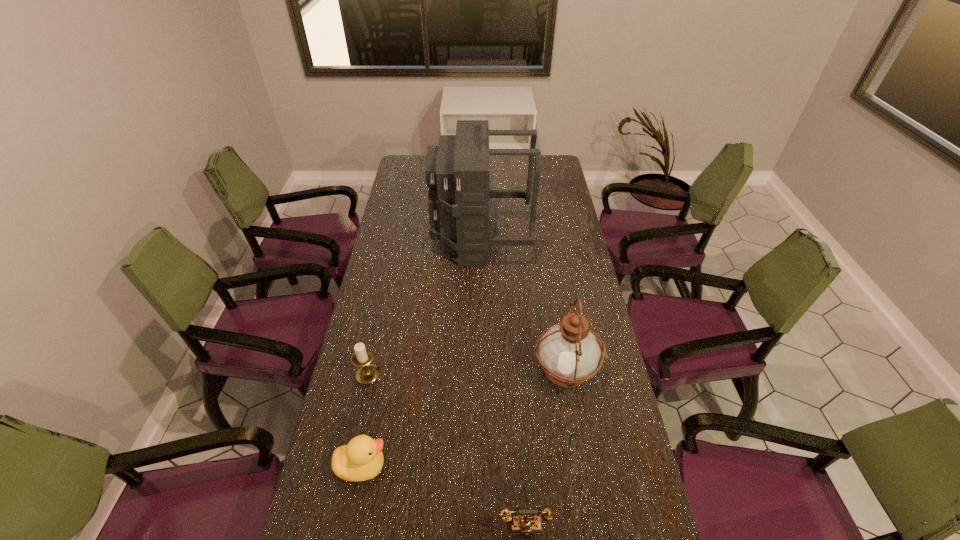
Image resolution: width=960 pixels, height=540 pixels. I want to click on empty space between the oil lamp and the candle holder, so click(x=467, y=373).

Locate an element on the screen. This screenshot has height=540, width=960. empty space that is in between the fourth farthest object and the tallest object is located at coordinates (421, 353).

This screenshot has height=540, width=960. Find the location of `free area in between the oil lamp and the duck`. free area in between the oil lamp and the duck is located at coordinates (464, 419).

Image resolution: width=960 pixels, height=540 pixels. What are the coordinates of `object that is the second nearest to the duck` in the screenshot? It's located at (524, 524).

Identify the location of object that stands as the third closest to the oil lamp. (362, 459).